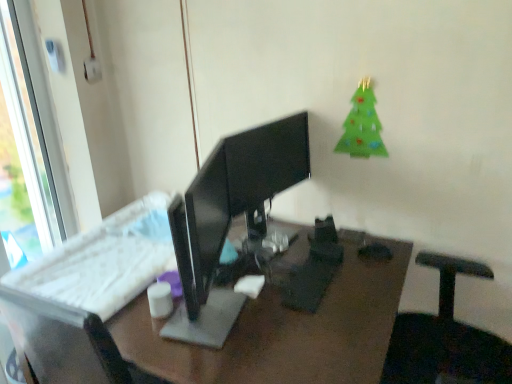
You are a GUI agent. You are given a task and a screenshot of the screen. Output one action in this format:
    pyautogui.click(x=<x>, y=<y>)
    Task: Click on the white plastic keyboard at center
    The height and width of the screenshot is (384, 512).
    Given the screenshot: What is the action you would take?
    pyautogui.click(x=230, y=333)

I want to click on green felt christmas tree at upper right, so click(362, 125).

Describe the element at coordinates (362, 125) in the screenshot. The image size is (512, 384). I see `green felt christmas tree at upper right` at that location.

At what (x,y) coordinates should I click in order to perform the action: click on white matte cup at center. Please return your answer as a coordinate pair (x, y). This screenshot has width=512, height=384. Looking at the image, I should click on (160, 300).

Is white plastic window at left facing away from white matte cup at center?

white plastic window at left does not have its back to white matte cup at center.

From the image's perspective, is white plastic window at left beneath white matte cup at center?

No, from the image's perspective, white plastic window at left is not beneath white matte cup at center.

Measure the distance between white plastic window at left and white matte cup at center.

4.05 feet.

Is white plastic window at left wider or thinner than white matte cup at center?

Clearly, white plastic window at left has less width compared to white matte cup at center.

Which point is more distant from viewer, (281, 359) or (242, 161)?

The point (242, 161) is farther from the camera.

From the image's perspective, is white plastic keyboard at center below black glossy monitor at center?

Yes, from the image's perspective, white plastic keyboard at center is below black glossy monitor at center.

Is there a large distance between white plastic keyboard at center and black glossy monitor at center?

white plastic keyboard at center is actually quite close to black glossy monitor at center.

Does green felt christmas tree at upper right have a larger size compared to black glossy monitor at center?

Incorrect, green felt christmas tree at upper right is not larger than black glossy monitor at center.

Are green felt christmas tree at upper right and black glossy monitor at center far apart?

green felt christmas tree at upper right is near black glossy monitor at center, not far away.

Does green felt christmas tree at upper right contain black glossy monitor at center?

Actually, black glossy monitor at center is outside green felt christmas tree at upper right.

Is green felt christmas tree at upper right to the right of black glossy monitor at center from the viewer's perspective?

Yes.

How many degrees apart are the facing directions of white matte cup at center and black glossy monitor at center?

The facing directions of white matte cup at center and black glossy monitor at center are 89.1 degrees apart.

Is white matte cup at center far away from black glossy monitor at center?

That's not correct — white matte cup at center is a little close to black glossy monitor at center.

Considering the sizes of white matte cup at center and black glossy monitor at center in the image, is white matte cup at center wider or thinner than black glossy monitor at center?

In the image, white matte cup at center appears to be more narrow than black glossy monitor at center.

In the scene shown: From a real-world perspective, which object rests below the other?

white plastic keyboard at center.

Consider the image. Would you consider white plastic keyboard at center to be distant from white plastic window at left?

Yes, white plastic keyboard at center is far from white plastic window at left.

Between white plastic keyboard at center and white plastic window at left, which one appears on the right side from the viewer's perspective?

Positioned to the right is white plastic keyboard at center.

From the picture: From the image's perspective, which is above, white plastic keyboard at center or white plastic window at left?

white plastic window at left.

At what (x,y) coordinates should I click in order to perform the action: click on tableware below the green felt christmas tree at upper right (from the image's perspective). Please return your answer as a coordinate pair (x, y). Looking at the image, I should click on (160, 300).

Which object is positioned more to the right, white matte cup at center or green felt christmas tree at upper right?

green felt christmas tree at upper right.

Is white matte cup at center placed right next to green felt christmas tree at upper right?

No, white matte cup at center is not next to green felt christmas tree at upper right.

Considering the relative sizes of black glossy monitor at center and white plastic window at left in the image provided, is black glossy monitor at center shorter than white plastic window at left?

Yes, black glossy monitor at center is shorter than white plastic window at left.

Does black glossy monitor at center contain white plastic window at left?

That's incorrect, white plastic window at left is not inside black glossy monitor at center.

From the image's perspective, is black glossy monitor at center over white plastic window at left?

No, from the image's perspective, black glossy monitor at center is not above white plastic window at left.

In the image, there is a black glossy monitor at center. Where is `window above it (from the image's perspective)`? This screenshot has height=384, width=512. window above it (from the image's perspective) is located at coordinates (26, 146).

Where is `window that is above the white matte cup at center (from a real-world perspective)`? Image resolution: width=512 pixels, height=384 pixels. window that is above the white matte cup at center (from a real-world perspective) is located at coordinates (26, 146).

I want to click on desk below the black glossy monitor at center (from a real-world perspective), so click(x=230, y=333).

From the image, which object appears to be farther from black glossy monitor at center, green felt christmas tree at upper right or white plastic keyboard at center?

white plastic keyboard at center is positioned further to the anchor black glossy monitor at center.

Based on their spatial positions, is black glossy monitor at center or white plastic window at left closer to white matte cup at center?

black glossy monitor at center is closer to white matte cup at center.

Looking at the image, which one is located further to white plastic window at left, white matte cup at center or black glossy monitor at center?

white matte cup at center is further to white plastic window at left.

Based on their spatial positions, is black glossy monitor at center or white plastic keyboard at center further from green felt christmas tree at upper right?

white plastic keyboard at center is further to green felt christmas tree at upper right.

Looking at the image, which one is located further to white plastic keyboard at center, white plastic window at left or green felt christmas tree at upper right?

white plastic window at left lies further to white plastic keyboard at center than the other object.

Which object lies further to the anchor point white matte cup at center, white plastic keyboard at center or white plastic window at left?

white plastic window at left.

When comparing their distances from white matte cup at center, does green felt christmas tree at upper right or white plastic window at left seem closer?

Among the two, green felt christmas tree at upper right is located nearer to white matte cup at center.

Estimate the real-world distances between objects in this image. Which object is further from white plastic keyboard at center, white plastic window at left or white matte cup at center?

Based on the image, white plastic window at left appears to be further to white plastic keyboard at center.

Locate an element on the screen. The image size is (512, 384). computer monitor between white plastic window at left and green felt christmas tree at upper right in the horizontal direction is located at coordinates (265, 167).

This screenshot has height=384, width=512. I want to click on tableware between white plastic window at left and green felt christmas tree at upper right in the horizontal direction, so click(160, 300).

This screenshot has width=512, height=384. What are the coordinates of `computer monitor between white matte cup at center and green felt christmas tree at upper right` in the screenshot? It's located at (265, 167).

Image resolution: width=512 pixels, height=384 pixels. I want to click on desk between white plastic window at left and black glossy monitor at center in the horizontal direction, so click(230, 333).